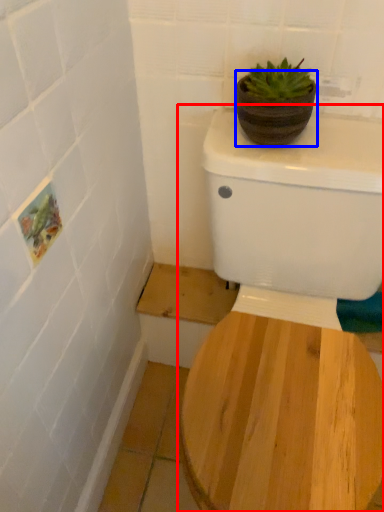
Question: Which of the following is the closest to the observer, toilet (highlighted by a red box) or flowerpot (highlighted by a blue box)?

Choices:
 (A) toilet
 (B) flowerpot

Answer: (A)